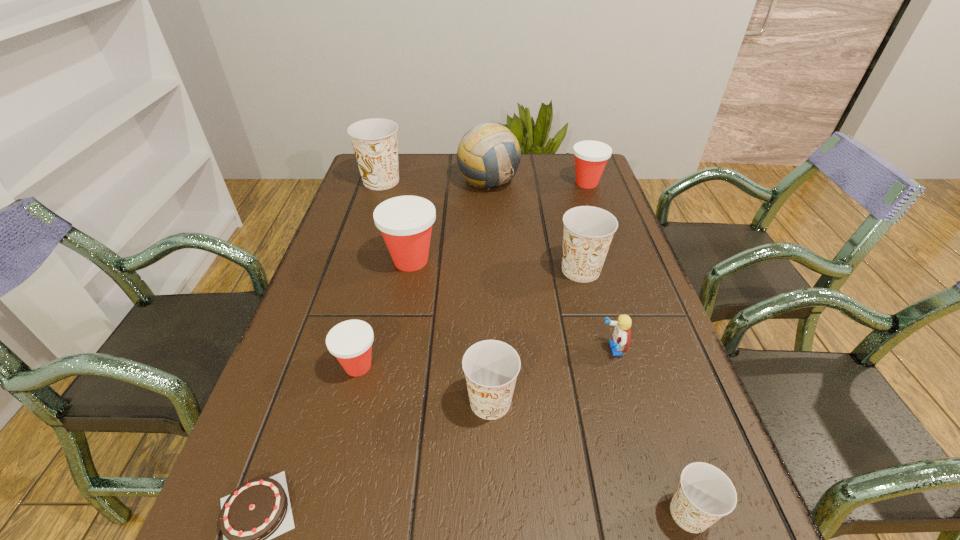
The width and height of the screenshot is (960, 540). Find the location of `the nearest red-orange Dixie cup`. the nearest red-orange Dixie cup is located at coordinates (350, 342).

Locate an element on the screen. The height and width of the screenshot is (540, 960). the nearest orange Dixie cup is located at coordinates (705, 494).

Where is `the nearest Dixie cup`? This screenshot has height=540, width=960. the nearest Dixie cup is located at coordinates 705,494.

Where is `free space located on the left of the volleyball`? The image size is (960, 540). free space located on the left of the volleyball is located at coordinates (394, 181).

Find the location of a particular element. Image resolution: width=960 pixels, height=540 pixels. vacant space located 0.200m on the front of the tallest Dixie cup is located at coordinates (365, 232).

Where is `free location located 0.060m on the right of the second farthest orange Dixie cup`? free location located 0.060m on the right of the second farthest orange Dixie cup is located at coordinates (630, 270).

Locate an element on the screen. This screenshot has height=540, width=960. free location located 0.290m on the right of the second farthest red-orange Dixie cup is located at coordinates coord(552,261).

Image resolution: width=960 pixels, height=540 pixels. In order to click on vacant space located 0.180m on the front of the farthest red-orange Dixie cup in this screenshot , I will do `click(602, 226)`.

The height and width of the screenshot is (540, 960). Identify the location of vacant space located on the back of the third orange Dixie cup from right to left. (x=489, y=333).

The width and height of the screenshot is (960, 540). I want to click on free space located 0.230m on the front-facing side of the Lego, so click(492, 349).